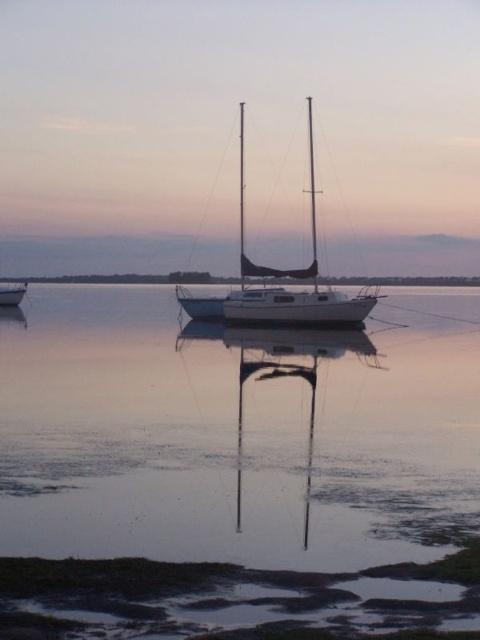
Is the position of smooth water at center more distant than that of white glossy sailboat at center?

No, smooth water at center is in front of white glossy sailboat at center.

I want to click on smooth water at center, so click(x=231, y=468).

This screenshot has height=640, width=480. What do you see at coordinates (231, 468) in the screenshot? I see `smooth water at center` at bounding box center [231, 468].

Who is taller, smooth water at center or white glossy boat at left?

With more height is smooth water at center.

Where is `smooth water at center`? The height and width of the screenshot is (640, 480). smooth water at center is located at coordinates (231, 468).

Is white glossy sailboat at center below white glossy boat at left?

No.

Where is `white glossy sailboat at center`? white glossy sailboat at center is located at coordinates (279, 278).

Image resolution: width=480 pixels, height=640 pixels. What do you see at coordinates (279, 278) in the screenshot? I see `white glossy sailboat at center` at bounding box center [279, 278].

Identify the location of white glossy sailboat at center. (279, 278).